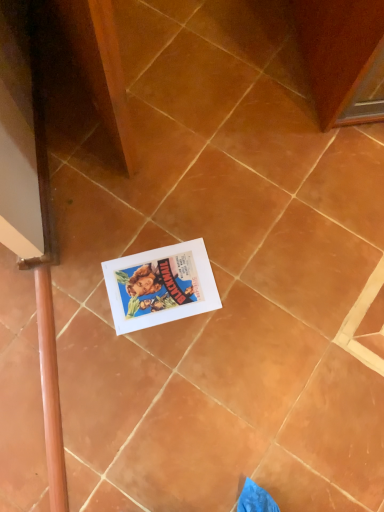
Identify the location of brown matte pipe at left. Image resolution: width=384 pixels, height=512 pixels. (50, 390).

What do you see at coordinates (50, 390) in the screenshot? I see `brown matte pipe at left` at bounding box center [50, 390].

In order to click on brown matte pipe at left in this screenshot , I will do (x=50, y=390).